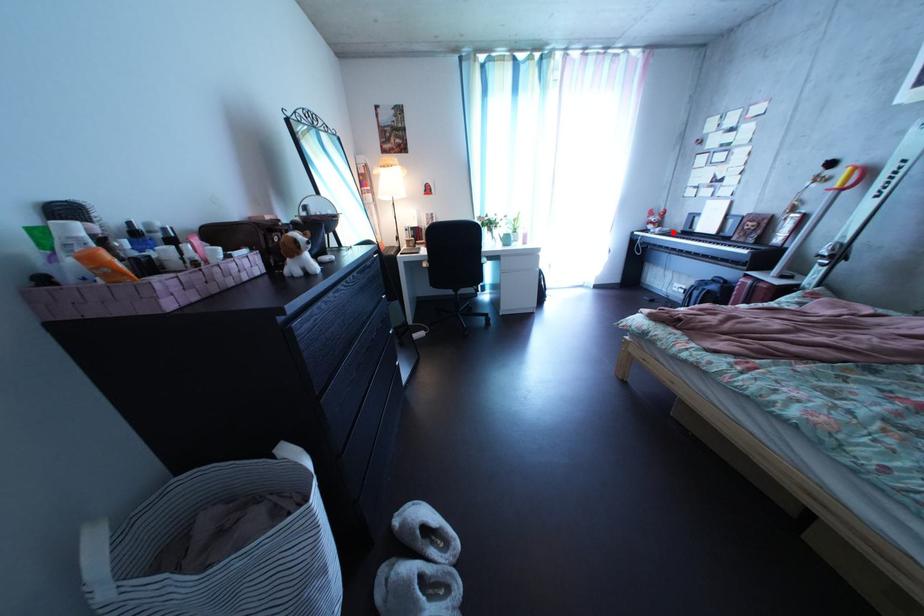
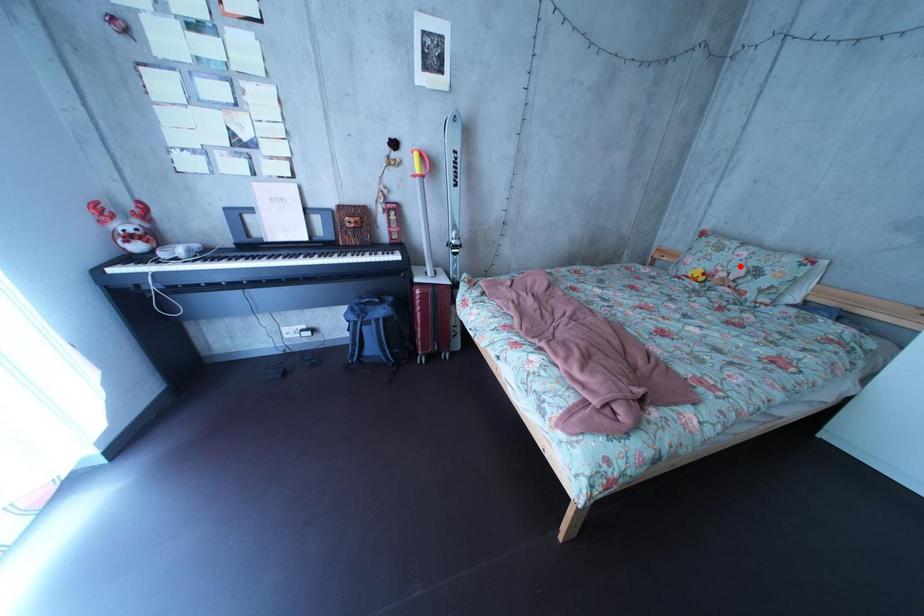
I am providing you with two images of the same scene from different viewpoints. A red point is marked on the first image and another point is marked on the second image. Are the points marked in image1 and image2 representing the same 3D position?

No